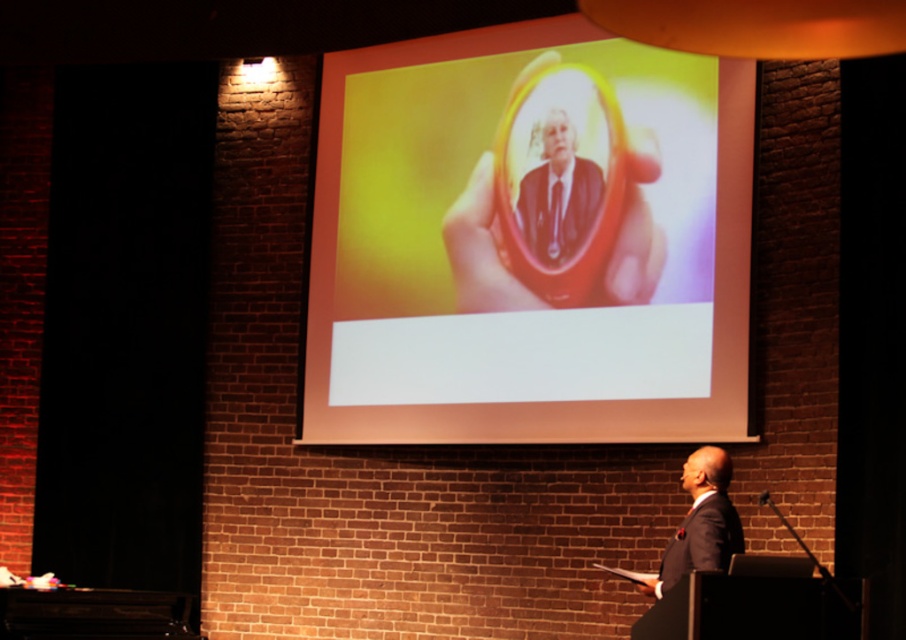
You are a presenter standing at the podium on the right side of the room. You notice a matte plastic mirror at center located at point (527, 248). If you want to check your posture during the presentation, can you see your reflection in the matte plastic mirror at center from your current position?

The matte plastic mirror at center is located at point (527, 248). Since you are standing at the podium on the right side of the room, you would be able to see your reflection in the matte plastic mirror at center as long as there is a clear line of sight between your position and the mirror.

You are setting up a presentation in the conference room and need to place a decorative item on the podium. The podium is positioned to the right side of the room. Where should you place the matte plastic mirror at center to ensure it is centered on the podium?

The matte plastic mirror at center is located at point (x=527, y=248), so you should place it at that coordinate to center it on the podium.

You are standing in the conference room and notice two points marked on the projection screen. Which point, point (500, 64) or point (519, 218), is closer to you?

Point (500, 64) is further to the viewer than point (519, 218), so the point closer to you is point (519, 218).